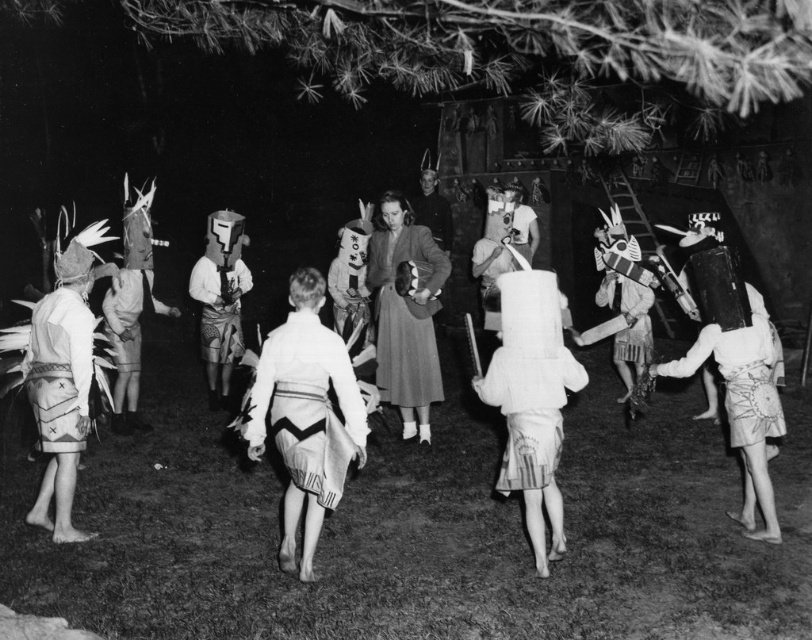
You are an observer at the nighttime event. You see the white fabric skirt at lower right and the patterned fabric headdress at center. Which object is positioned lower in the image?

The white fabric skirt at lower right is positioned lower than the patterned fabric headdress at center in the image.

You are an observer at the nighttime event. You notice the white cotton skirt at center and the patterned fabric headdress at center. Which object is shorter in height?

The white cotton skirt at center has a lesser height compared to the patterned fabric headdress at center, so the white cotton skirt at center is shorter in height.